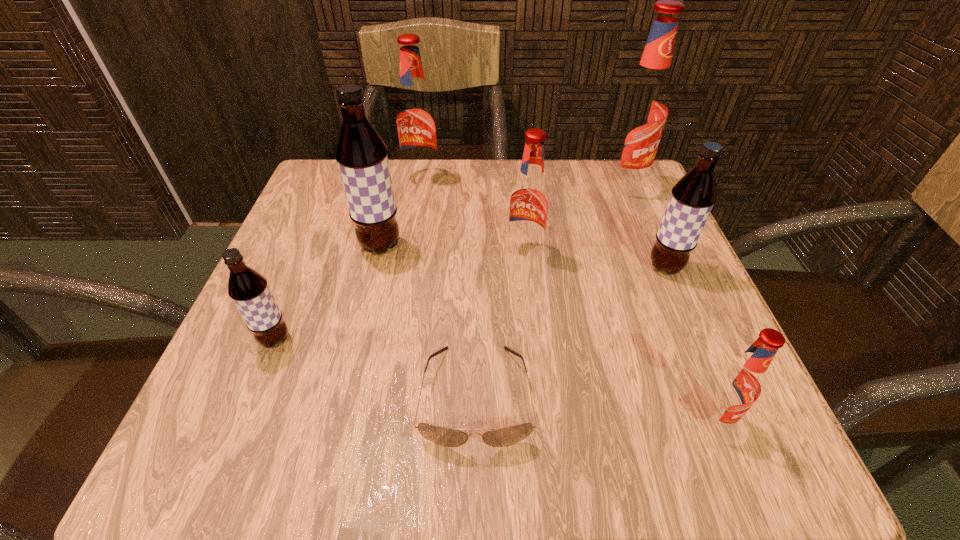
At what (x,y) coordinates should I click in order to perform the action: click on empty location between the nearest root beer and the leftmost brown root beer. Please return your answer as a coordinate pair (x, y). The height and width of the screenshot is (540, 960). Looking at the image, I should click on (493, 380).

You are a GUI agent. You are given a task and a screenshot of the screen. Output one action in this format:
    pyautogui.click(x=<x>, y=<y>)
    Task: Click on the free spot between the shortest object and the rightmost brown root beer
    
    Given the screenshot: What is the action you would take?
    pyautogui.click(x=570, y=332)

Identify the location of unoccupied area between the nearest red root beer and the sunglasses. This screenshot has width=960, height=540. (594, 407).

This screenshot has height=540, width=960. I want to click on empty space between the biggest brown root beer and the sunglasses, so click(x=428, y=321).

Where is `vacant space in between the third farthest red root beer and the second biggest brown root beer`? vacant space in between the third farthest red root beer and the second biggest brown root beer is located at coordinates (595, 259).

Find the location of `free space between the second nearest root beer and the shortest object`. free space between the second nearest root beer and the shortest object is located at coordinates (375, 368).

Locate an element on the screen. free space between the shortest object and the leftmost root beer is located at coordinates (375, 368).

The width and height of the screenshot is (960, 540). Identify the location of blank region between the second brown root beer from left to right and the tallest object. (501, 216).

Find the location of `free point between the second brown root beer from right to left and the sunglasses`. free point between the second brown root beer from right to left and the sunglasses is located at coordinates (428, 321).

Choose which object is the fifth nearest neighbor to the second biggest red root beer. Please provide its 2D coordinates. Your answer should be formatted as a tuple, i.e. [(x, y)], where the tuple contains the x and y coordinates of a point satisfying the conditions above.

[(502, 437)]